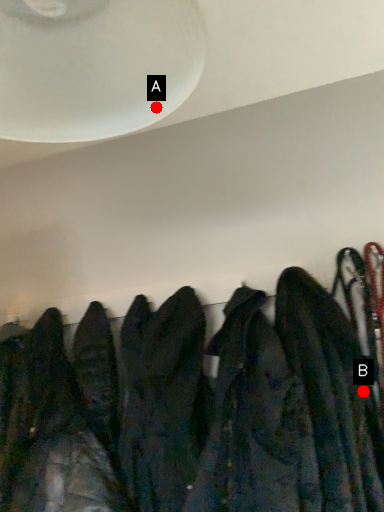
Question: Two points are circled on the image, labeled by A and B beside each circle. Which of the following is the farthest from the observer?

Choices:
 (A) A is further
 (B) B is further

Answer: (B)